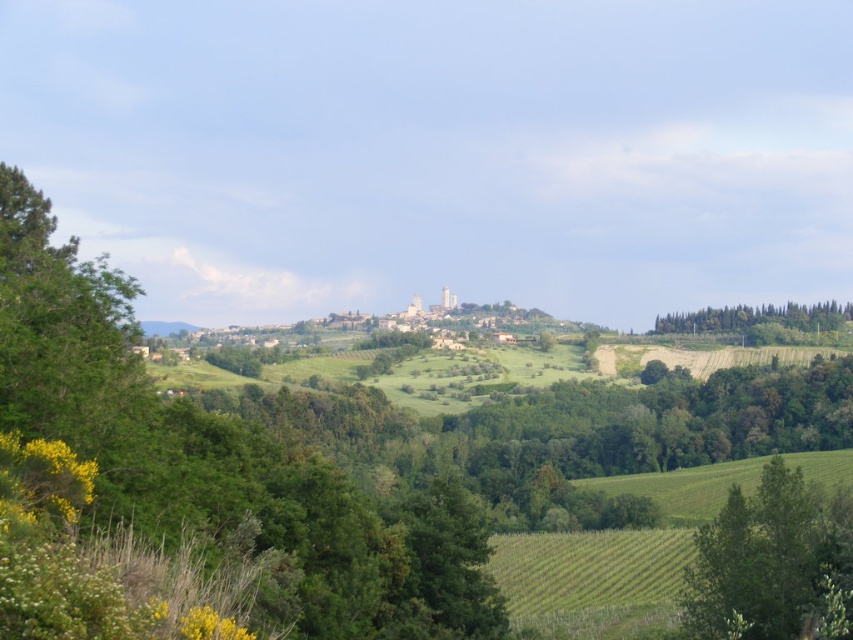
Question: Is green leafy tree at lower right wider than green leafy trees at right?

Choices:
 (A) yes
 (B) no

Answer: (B)

Question: Which object appears closest to the camera in this image?

Choices:
 (A) green leafy trees at right
 (B) green leafy tree at lower right

Answer: (B)

Question: Can you confirm if green leafy tree at lower right is smaller than green leafy trees at right?

Choices:
 (A) no
 (B) yes

Answer: (A)

Question: Which point appears closest to the camera in this image?

Choices:
 (A) (779, 307)
 (B) (828, 561)

Answer: (B)

Question: Is green leafy tree at lower right positioned behind green leafy trees at right?

Choices:
 (A) no
 (B) yes

Answer: (A)